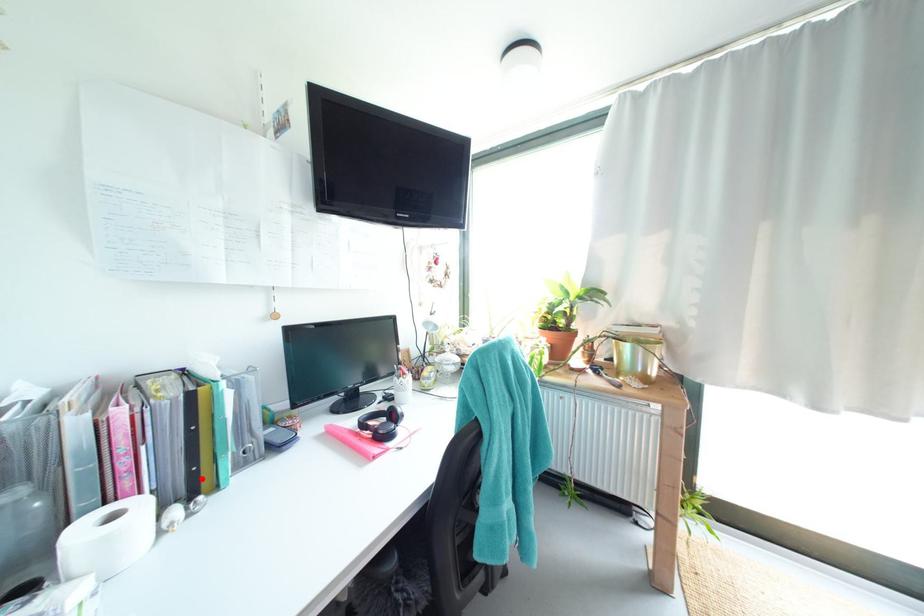
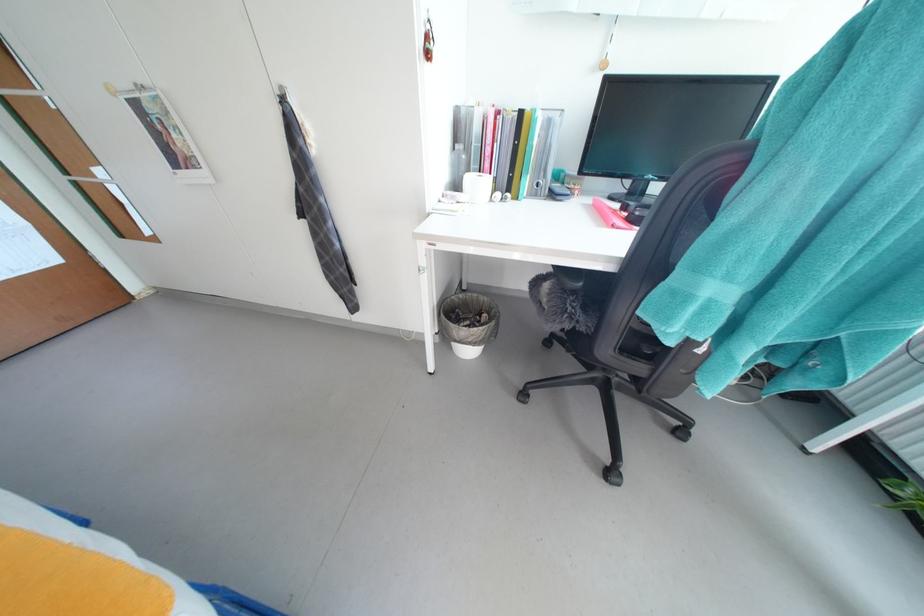
In the second image, find the point that corresponds to the highlighted location in the first image.

(517, 183)